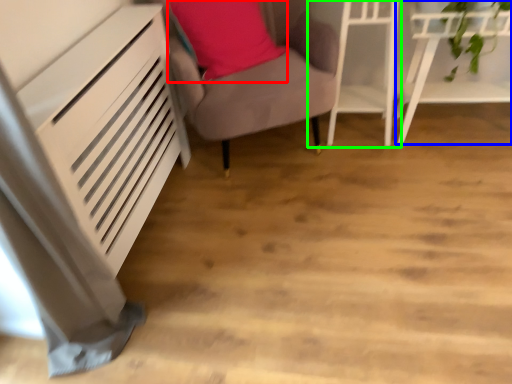
Question: Considering the real-world distances, which object is farthest from pillow (highlighted by a red box)? furniture (highlighted by a blue box) or furniture (highlighted by a green box)?

Choices:
 (A) furniture
 (B) furniture

Answer: (A)